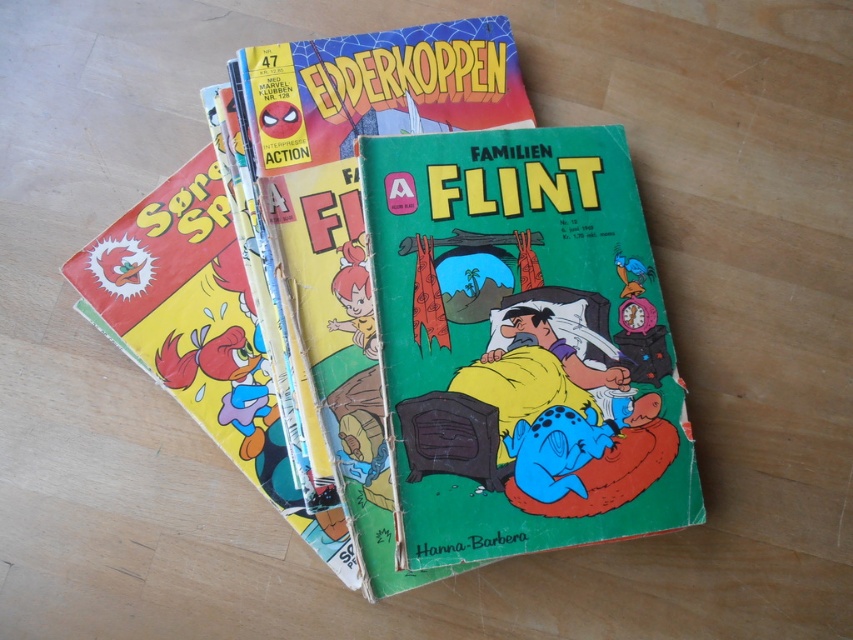
Question: Can you confirm if matte yellow comic book at center is positioned below green glossy comic book at center?

Choices:
 (A) no
 (B) yes

Answer: (A)

Question: Is matte yellow comic book at center to the right of green glossy comic book at center from the viewer's perspective?

Choices:
 (A) yes
 (B) no

Answer: (B)

Question: Which object appears farthest from the camera in this image?

Choices:
 (A) matte yellow comic book at center
 (B) green glossy comic book at center

Answer: (B)

Question: Which object is closer to the camera taking this photo?

Choices:
 (A) matte yellow comic book at center
 (B) green glossy comic book at center

Answer: (A)

Question: Does matte yellow comic book at center appear over green glossy comic book at center?

Choices:
 (A) yes
 (B) no

Answer: (A)

Question: Which of the following is the farthest from the observer?

Choices:
 (A) (567, 506)
 (B) (502, 209)

Answer: (B)